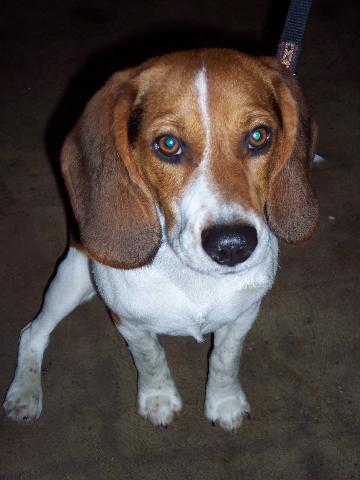
This screenshot has width=360, height=480. Find the location of `dark carpet`. dark carpet is located at coordinates (157, 10), (238, 6).